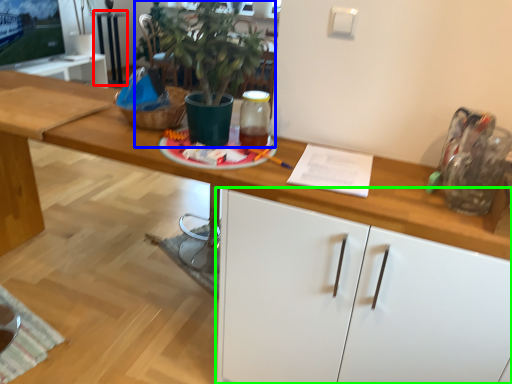
Question: Which is farther away from table (highlighted by a red box)? houseplant (highlighted by a blue box) or cabinetry (highlighted by a green box)?

Choices:
 (A) houseplant
 (B) cabinetry

Answer: (B)